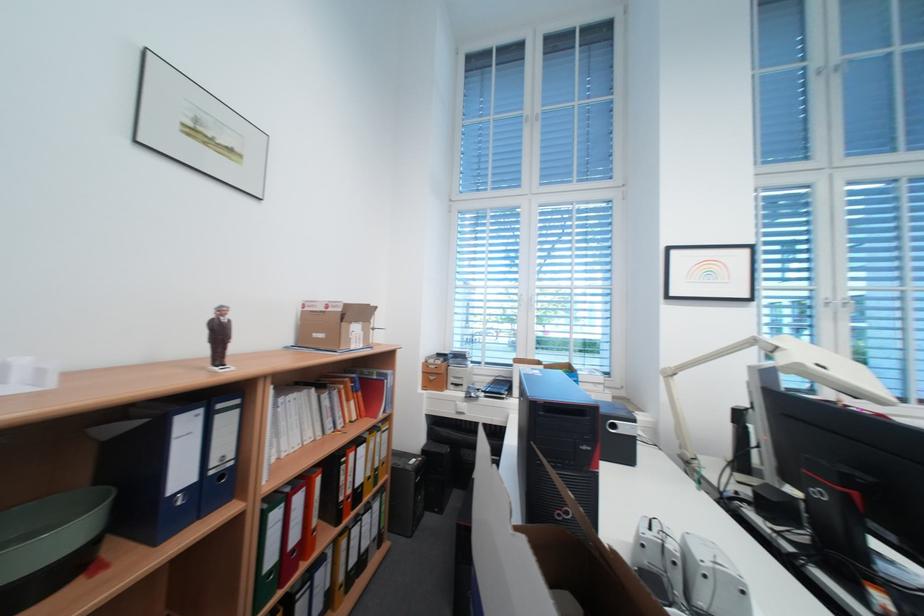
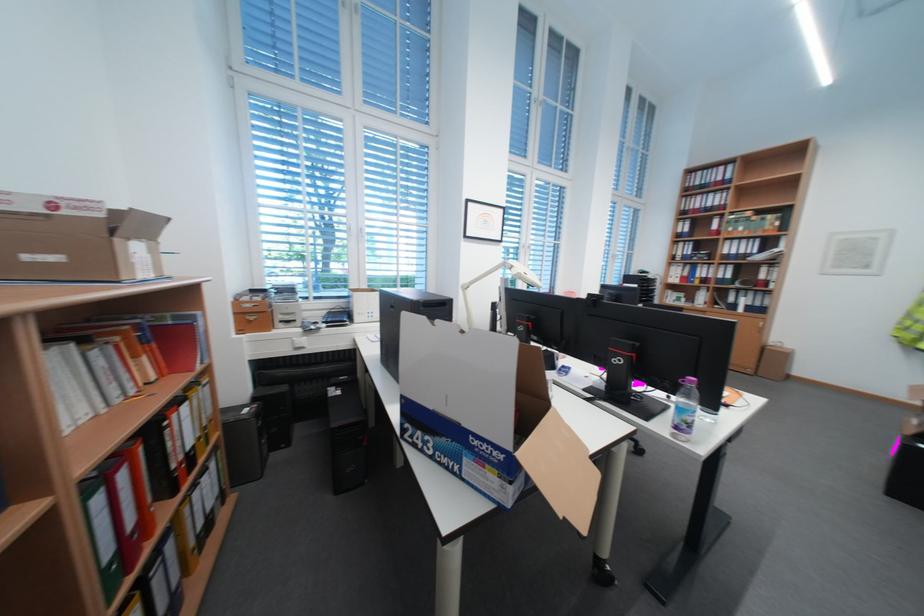
Where in the second image is the point corresponding to (x=796, y=351) from the first image?

(526, 268)